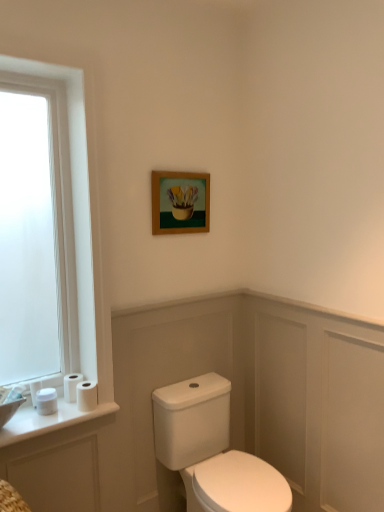
Find the location of a particular element. The image size is (384, 512). vacant area to the right of white glossy sink at lower left is located at coordinates (57, 413).